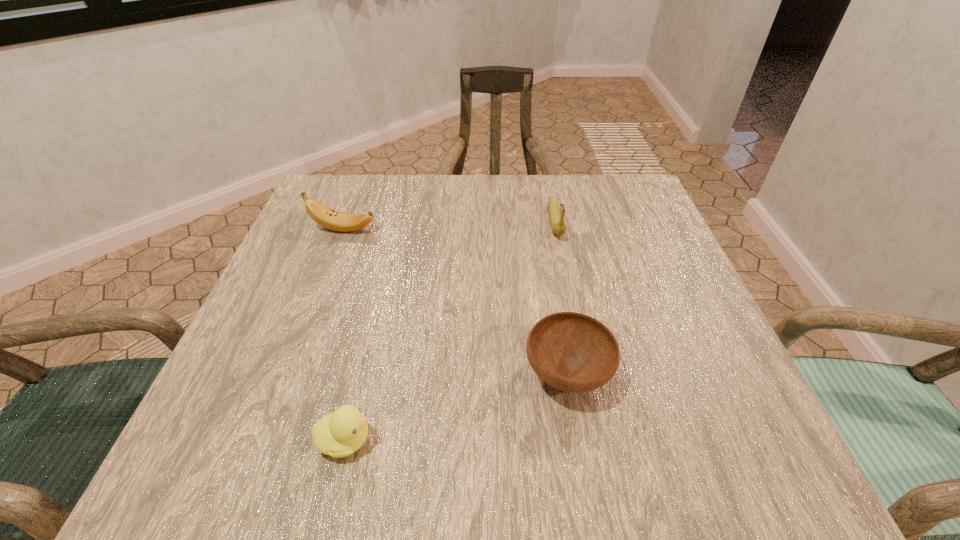
This screenshot has width=960, height=540. Find the location of `vacant area between the duckling and the left banana`. vacant area between the duckling and the left banana is located at coordinates (345, 334).

Where is `unoccupied position between the left banana and the right banana`? This screenshot has width=960, height=540. unoccupied position between the left banana and the right banana is located at coordinates (449, 226).

Locate an element on the screen. Image resolution: width=960 pixels, height=540 pixels. free spot between the right banana and the nearest object is located at coordinates (450, 331).

Image resolution: width=960 pixels, height=540 pixels. I want to click on empty space that is in between the left banana and the bowl, so click(x=455, y=301).

Where is `free spot between the bowl and the right banana`? Image resolution: width=960 pixels, height=540 pixels. free spot between the bowl and the right banana is located at coordinates (561, 298).

Locate an element on the screen. The height and width of the screenshot is (540, 960). empty location between the left banana and the bowl is located at coordinates (455, 301).

Image resolution: width=960 pixels, height=540 pixels. What are the coordinates of `unoccupied area between the duckling and the right banana` in the screenshot? It's located at (450, 331).

This screenshot has height=540, width=960. I want to click on object that is the closest to the right banana, so click(x=573, y=352).

Locate an element on the screen. the third closest object to the third farthest object is located at coordinates (328, 217).

The width and height of the screenshot is (960, 540). Find the location of `free space that satisfies the following two spatial constraints: 1. on the front side of the left banana; 2. on the right side of the second nearest object`. free space that satisfies the following two spatial constraints: 1. on the front side of the left banana; 2. on the right side of the second nearest object is located at coordinates (289, 374).